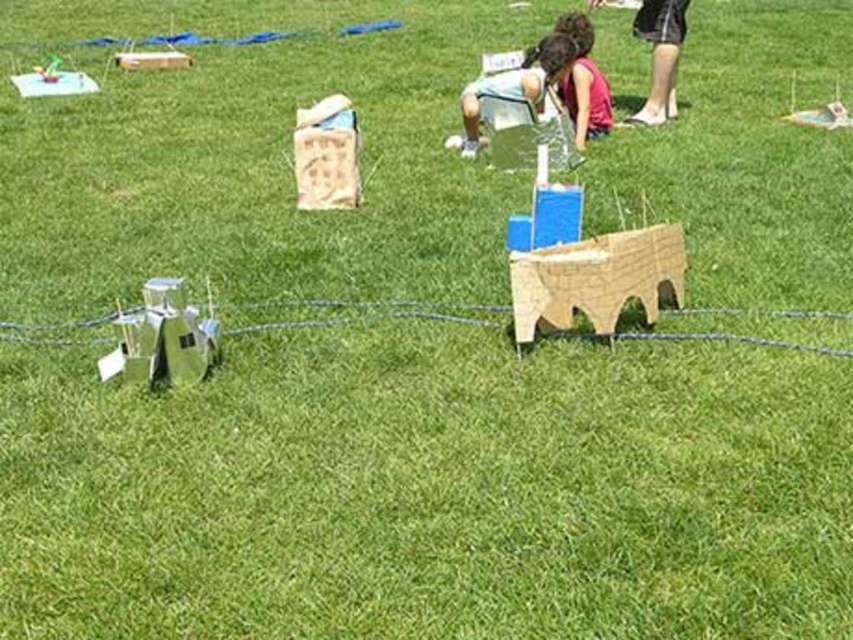
Measure the distance from green cardboard string at lower left to light brown cardboard at center.

A distance of 8.67 feet exists between green cardboard string at lower left and light brown cardboard at center.

Is green cardboard string at lower left smaller than light brown cardboard at center?

Indeed, green cardboard string at lower left has a smaller size compared to light brown cardboard at center.

Describe the element at coordinates (366, 312) in the screenshot. I see `green cardboard string at lower left` at that location.

Where is `green cardboard string at lower left`? green cardboard string at lower left is located at coordinates (366, 312).

Does light brown cardboard at center have a larger size compared to black fabric shorts at upper right?

Yes, light brown cardboard at center is bigger than black fabric shorts at upper right.

You are a GUI agent. You are given a task and a screenshot of the screen. Output one action in this format:
    pyautogui.click(x=<x>, y=<y>)
    Task: Click on the light brown cardboard at center
    The image size is (853, 640).
    Given the screenshot: What is the action you would take?
    pyautogui.click(x=515, y=84)

At what (x,y) coordinates should I click in order to perform the action: click on green cardboard string at lower left. Please return your answer as a coordinate pair (x, y). Looking at the image, I should click on (366, 312).

Is point (286, 326) closer to viewer compared to point (662, 92)?

Yes, it is.

Which is behind, point (329, 324) or point (653, 90)?

Positioned behind is point (653, 90).

The image size is (853, 640). I want to click on green cardboard string at lower left, so click(366, 312).